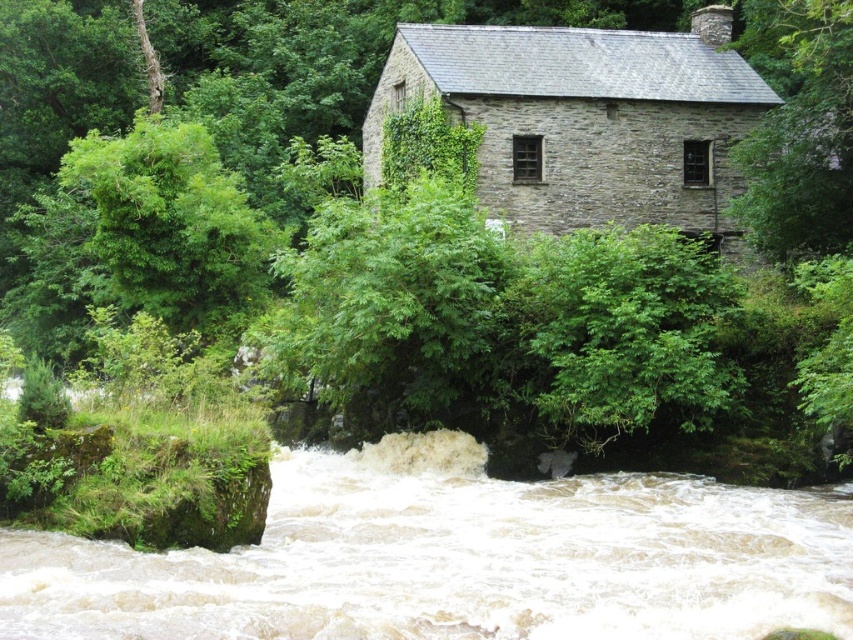
Question: Among these points, which one is nearest to the camera?

Choices:
 (A) (418, 544)
 (B) (659, 1)

Answer: (A)

Question: From the image, what is the correct spatial relationship of white frothy water at lower center in relation to green leafy tree at center?

Choices:
 (A) below
 (B) above

Answer: (A)

Question: Among these points, which one is nearest to the camera?

Choices:
 (A) pos(323,42)
 (B) pos(303,554)

Answer: (B)

Question: Considering the relative positions of white frothy water at lower center and green leafy tree at center in the image provided, where is white frothy water at lower center located with respect to green leafy tree at center?

Choices:
 (A) left
 (B) right

Answer: (B)

Question: Which object appears closest to the camera in this image?

Choices:
 (A) white frothy water at lower center
 (B) green leafy tree at center

Answer: (A)

Question: Is white frothy water at lower center above green leafy tree at center?

Choices:
 (A) no
 (B) yes

Answer: (A)